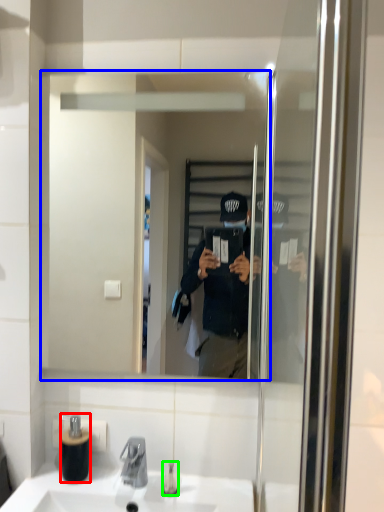
Question: Which object is the farthest from bottle (highlighted by a red box)? Choose among these: mirror (highlighted by a blue box) or toiletry (highlighted by a green box).

Choices:
 (A) mirror
 (B) toiletry

Answer: (A)